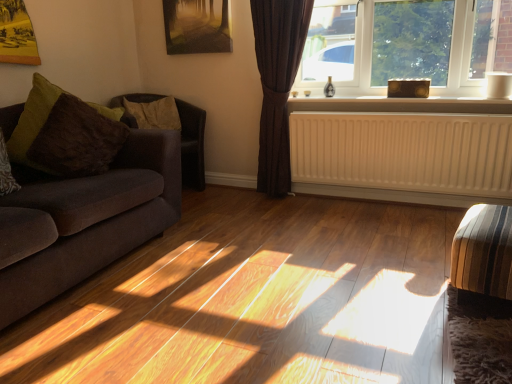
Locate an element on the screen. The image size is (512, 384). free point above white matte radiator at lower center (from a real-world perspective) is located at coordinates (397, 108).